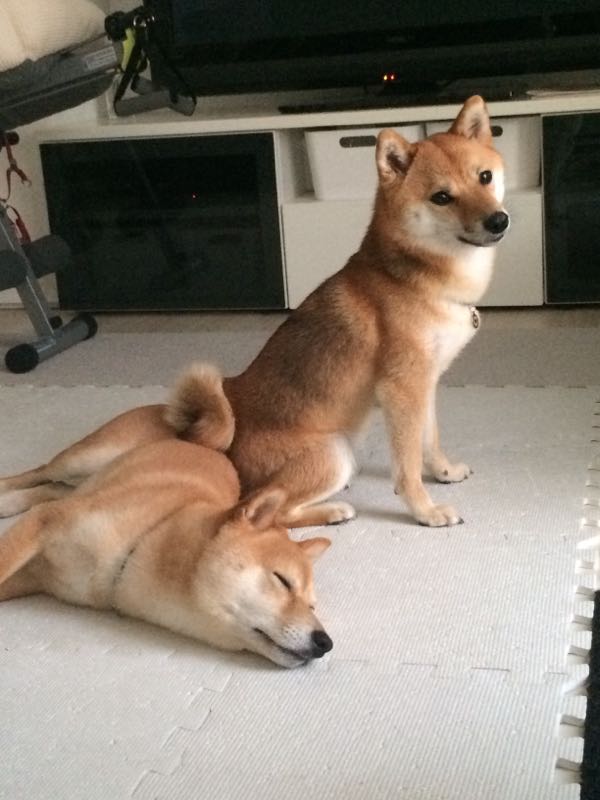
Identify the location of television. (394, 22).